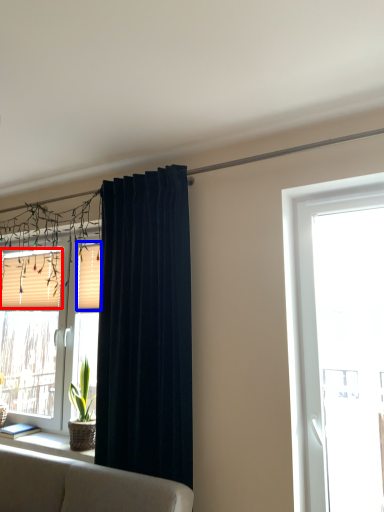
Question: Which point is further to the camera, shutter (highlighted by a red box) or shutter (highlighted by a blue box)?

Choices:
 (A) shutter
 (B) shutter

Answer: (A)